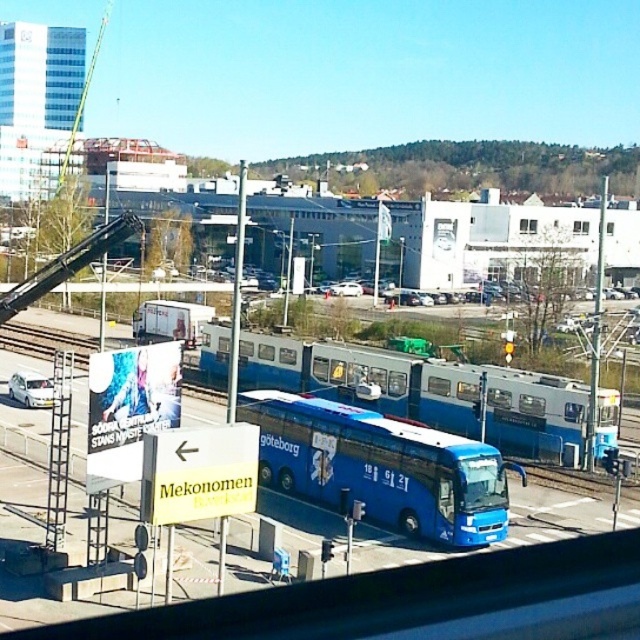
From the picture: You are a delivery person who needs to unload a package that requires a space of 10 meters between two buses. Can you place the package between the blue matte bus at center and the blue metallic bus at center?

The blue matte bus at center is 9.93 meters from blue metallic bus at center, so the space is insufficient for the package requiring 10 meters. You cannot place the package there.